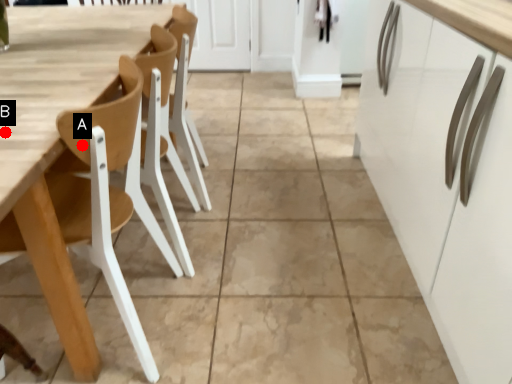
Question: Two points are circled on the image, labeled by A and B beside each circle. Which point is closer to the camera taking this photo?

Choices:
 (A) A is closer
 (B) B is closer

Answer: (B)